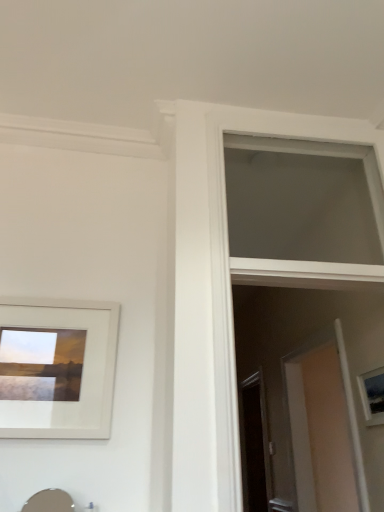
Measure the distance between point (368, 414) and camera.

The depth of point (368, 414) is 1.90 meters.

Describe the element at coordinates (254, 444) in the screenshot. I see `transparent glass screen door at center` at that location.

In order to click on white matte picture frame at upper left, the 2th picture frame when ordered from right to left in this screenshot , I will do `click(57, 368)`.

What is the approximate width of white matte picture frame at upper left, the 2th picture frame when ordered from right to left?

1.15 inches.

Locate an element on the screen. matte white picture frame at right, which appears as the 2th picture frame when viewed from the front is located at coordinates (372, 395).

Considering the positions of objects matte white picture frame at right, which appears as the 2th picture frame when viewed from the front, and matte silver sink at lower left in the image provided, who is more to the left, matte white picture frame at right, which appears as the 2th picture frame when viewed from the front, or matte silver sink at lower left?

matte silver sink at lower left is more to the left.

Considering the sizes of objects matte white picture frame at right, which is the first picture frame in right-to-left order, and matte silver sink at lower left in the image provided, who is taller, matte white picture frame at right, which is the first picture frame in right-to-left order, or matte silver sink at lower left?

Standing taller between the two is matte silver sink at lower left.

Does matte white picture frame at right, placed as the 2th picture frame when sorted from left to right, have a lesser width compared to matte silver sink at lower left?

Yes, matte white picture frame at right, placed as the 2th picture frame when sorted from left to right, is thinner than matte silver sink at lower left.

Is white matte window at upper center to the left or to the right of matte white picture frame at right, placed as the 2th picture frame when sorted from left to right, in the image?

In the image, white matte window at upper center appears on the left side of matte white picture frame at right, placed as the 2th picture frame when sorted from left to right.

Based on the photo, is white matte window at upper center turned away from matte white picture frame at right, placed as the 2th picture frame when sorted from left to right?

No, white matte window at upper center is not facing the opposite direction of matte white picture frame at right, placed as the 2th picture frame when sorted from left to right.

Is white matte window at upper center positioned before matte white picture frame at right, which appears as the 2th picture frame when viewed from the front?

That is True.

Which is more to the left, matte silver sink at lower left or white matte window at upper center?

Positioned to the left is matte silver sink at lower left.

From the image's perspective, between matte silver sink at lower left and white matte window at upper center, who is located below?

matte silver sink at lower left.

Which object is thinner, matte silver sink at lower left or white matte window at upper center?

With smaller width is matte silver sink at lower left.

From a real-world perspective, which object rests below the other?

From a 3D spatial view, matte silver sink at lower left is below.

Locate an element on the screen. window above the transparent glass screen door at center (from the image's perspective) is located at coordinates (303, 200).

Considering the relative positions of transparent glass screen door at center and white matte window at upper center in the image provided, is transparent glass screen door at center to the right of white matte window at upper center from the viewer's perspective?

Correct, you'll find transparent glass screen door at center to the right of white matte window at upper center.

Can you confirm if transparent glass screen door at center is wider than white matte window at upper center?

No.

Based on the photo, how much distance is there between transparent glass screen door at center and matte white picture frame at right, which is the first picture frame in right-to-left order?

They are 1.60 meters apart.

Which object is further away from the camera, transparent glass screen door at center or matte white picture frame at right, which appears as the 2th picture frame when viewed from the front?

transparent glass screen door at center is further away from the camera.

Is point (252, 400) behind point (383, 413)?

Yes, point (252, 400) is farther from viewer.

From a real-world perspective, is transparent glass screen door at center physically above matte white picture frame at right, placed as the 2th picture frame when sorted from left to right?

Actually, transparent glass screen door at center is physically below matte white picture frame at right, placed as the 2th picture frame when sorted from left to right, in the real world.

Would you say matte white picture frame at right, which is counted as the first picture frame, starting from the back, is inside or outside white matte window at upper center?

matte white picture frame at right, which is counted as the first picture frame, starting from the back, lies outside white matte window at upper center.

In terms of width, does matte white picture frame at right, which appears as the 2th picture frame when viewed from the front, look wider or thinner when compared to white matte window at upper center?

matte white picture frame at right, which appears as the 2th picture frame when viewed from the front, is thinner than white matte window at upper center.

Consider the image. Is matte white picture frame at right, which is the first picture frame in right-to-left order, smaller than white matte window at upper center?

Correct, matte white picture frame at right, which is the first picture frame in right-to-left order, occupies less space than white matte window at upper center.

Can you confirm if matte white picture frame at right, which appears as the 2th picture frame when viewed from the front, is shorter than white matte window at upper center?

Correct, matte white picture frame at right, which appears as the 2th picture frame when viewed from the front, is not as tall as white matte window at upper center.

From a real-world perspective, who is located lower, matte white picture frame at right, placed as the 2th picture frame when sorted from left to right, or white matte picture frame at upper left, marked as the 1th picture frame in a front-to-back arrangement?

From a 3D spatial view, matte white picture frame at right, placed as the 2th picture frame when sorted from left to right, is below.

Between matte white picture frame at right, which appears as the 2th picture frame when viewed from the front, and white matte picture frame at upper left, the 1th picture frame in the left-to-right sequence, which one has less height?

matte white picture frame at right, which appears as the 2th picture frame when viewed from the front.

Does matte white picture frame at right, which appears as the 2th picture frame when viewed from the front, appear on the left side of white matte picture frame at upper left, the 2th picture frame when ordered from right to left?

No, matte white picture frame at right, which appears as the 2th picture frame when viewed from the front, is not to the left of white matte picture frame at upper left, the 2th picture frame when ordered from right to left.

From the image's perspective, would you say matte white picture frame at right, which is counted as the first picture frame, starting from the back, is shown under white matte picture frame at upper left, arranged as the 2th picture frame when viewed from the back?

Yes.

Find the location of a particular element. Image resolution: width=384 pixels, height=512 pixels. picture frame located on the right of matte silver sink at lower left is located at coordinates (372, 395).

The image size is (384, 512). I want to click on window to the left of matte white picture frame at right, which is the first picture frame in right-to-left order, so click(x=303, y=200).

Which object lies nearer to the anchor point transparent glass screen door at center, white matte window at upper center or matte silver sink at lower left?

Among the two, white matte window at upper center is located nearer to transparent glass screen door at center.

When comparing their distances from matte silver sink at lower left, does matte white picture frame at right, which appears as the 2th picture frame when viewed from the front, or transparent glass screen door at center seem further?

Based on the image, transparent glass screen door at center appears to be further to matte silver sink at lower left.

Estimate the real-world distances between objects in this image. Which object is closer to white matte picture frame at upper left, the 1th picture frame in the left-to-right sequence, transparent glass screen door at center or white matte window at upper center?

white matte window at upper center lies closer to white matte picture frame at upper left, the 1th picture frame in the left-to-right sequence, than the other object.

Which object lies further to the anchor point matte silver sink at lower left, white matte picture frame at upper left, marked as the 1th picture frame in a front-to-back arrangement, or white matte window at upper center?

white matte window at upper center is positioned further to the anchor matte silver sink at lower left.

Based on the photo, considering their positions, is transparent glass screen door at center positioned closer to matte white picture frame at right, which is counted as the first picture frame, starting from the back, than matte silver sink at lower left?

matte silver sink at lower left is closer to matte white picture frame at right, which is counted as the first picture frame, starting from the back.

When comparing their distances from matte white picture frame at right, which is counted as the first picture frame, starting from the back, does matte silver sink at lower left or white matte window at upper center seem further?

matte silver sink at lower left is further to matte white picture frame at right, which is counted as the first picture frame, starting from the back.

Based on their spatial positions, is white matte picture frame at upper left, the 2th picture frame when ordered from right to left, or transparent glass screen door at center further from matte white picture frame at right, placed as the 2th picture frame when sorted from left to right?

transparent glass screen door at center lies further to matte white picture frame at right, placed as the 2th picture frame when sorted from left to right, than the other object.

When comparing their distances from white matte window at upper center, does matte white picture frame at right, which is the first picture frame in right-to-left order, or white matte picture frame at upper left, the 2th picture frame when ordered from right to left, seem closer?

The object closer to white matte window at upper center is matte white picture frame at right, which is the first picture frame in right-to-left order.

Image resolution: width=384 pixels, height=512 pixels. I want to click on window positioned between matte silver sink at lower left and transparent glass screen door at center from near to far, so pyautogui.click(x=303, y=200).

Where is `window situated between white matte picture frame at upper left, the 1th picture frame in the left-to-right sequence, and matte white picture frame at right, which is the first picture frame in right-to-left order, from left to right`? The width and height of the screenshot is (384, 512). window situated between white matte picture frame at upper left, the 1th picture frame in the left-to-right sequence, and matte white picture frame at right, which is the first picture frame in right-to-left order, from left to right is located at coordinates (303, 200).

Image resolution: width=384 pixels, height=512 pixels. I want to click on sink situated between white matte picture frame at upper left, the 1th picture frame in the left-to-right sequence, and matte white picture frame at right, which appears as the 2th picture frame when viewed from the front, from left to right, so pos(49,501).

I want to click on window located between matte silver sink at lower left and matte white picture frame at right, which appears as the 2th picture frame when viewed from the front, in the left-right direction, so click(x=303, y=200).